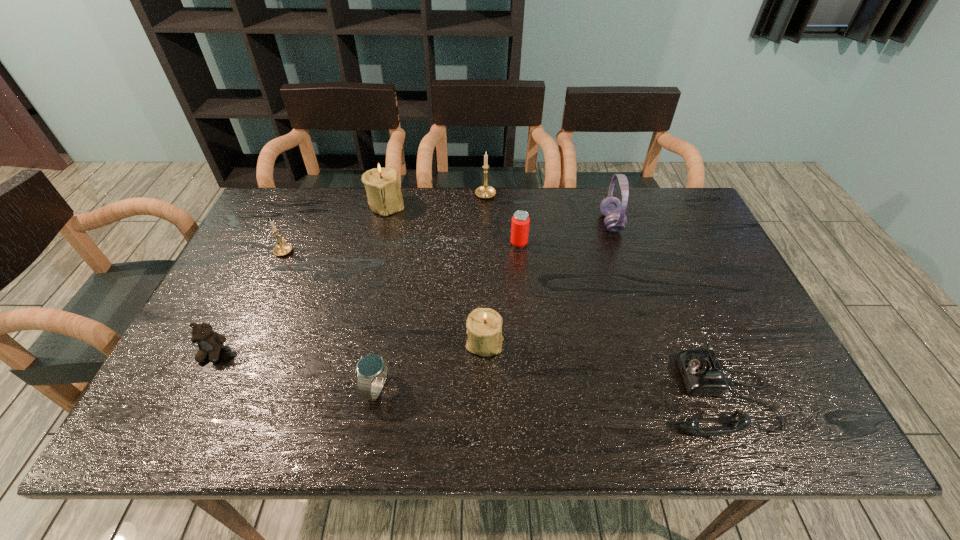
Find the location of a particular element. Image resolution: width=960 pixels, height=540 pixels. the left beige candle_holder is located at coordinates (382, 186).

You are a GUI agent. You are given a task and a screenshot of the screen. Output one action in this format:
    pyautogui.click(x=<x>, y=<y>)
    Task: Click on the third candle_holder from right to left
    
    Given the screenshot: What is the action you would take?
    pyautogui.click(x=382, y=186)

Locate an element on the screen. The image size is (960, 540). the bigger gold candle holder is located at coordinates (485, 191).

Locate an element on the screen. the farther gold candle holder is located at coordinates (485, 191).

You are a GUI agent. You are given a task and a screenshot of the screen. Output one action in this format:
    pyautogui.click(x=<x>, y=<y>)
    Task: Click on the headset
    Image resolution: width=960 pixels, height=540 pixels.
    Given the screenshot: What is the action you would take?
    pyautogui.click(x=611, y=207)

You are a GUI agent. You are given a task and a screenshot of the screen. Output one action in this format:
    pyautogui.click(x=<x>, y=<y>)
    Task: Click on the third farthest candle_holder
    The width and height of the screenshot is (960, 540).
    Given the screenshot: What is the action you would take?
    pyautogui.click(x=283, y=248)

Where is `the leftmost candle_holder`? This screenshot has height=540, width=960. the leftmost candle_holder is located at coordinates (283, 248).

The height and width of the screenshot is (540, 960). Identify the location of the nearer beige candle_holder. (484, 325).

This screenshot has height=540, width=960. In order to click on the smaller beige candle_holder in this screenshot , I will do `click(484, 325)`.

I want to click on red beer can, so click(x=520, y=223).